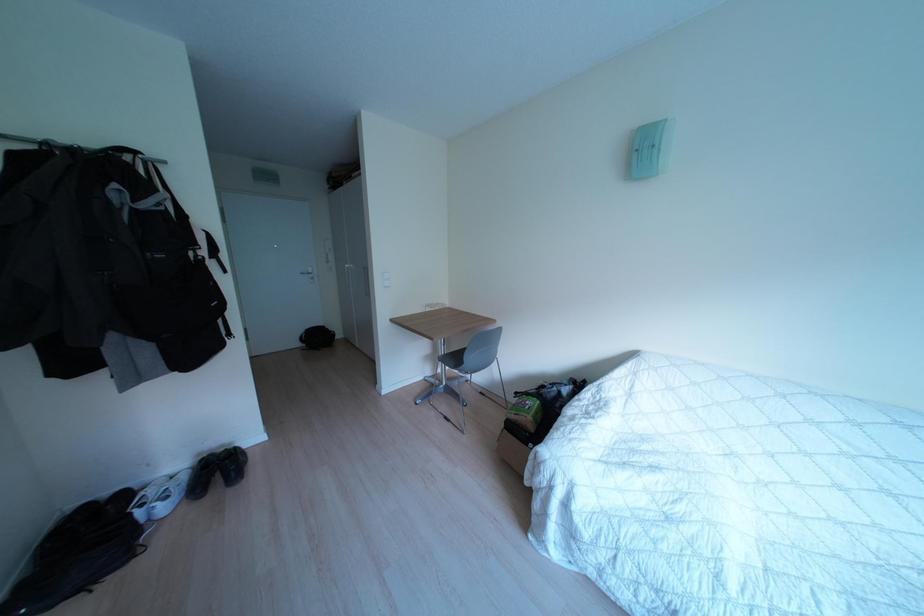
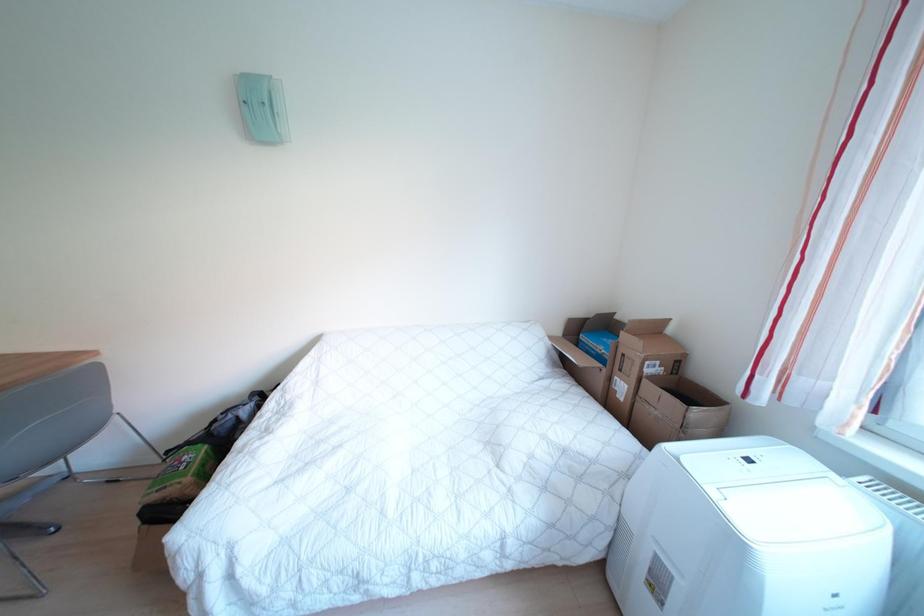
Question: How did the camera likely rotate?

Choices:
 (A) Left
 (B) Right
 (C) Up
 (D) Down

Answer: (B)